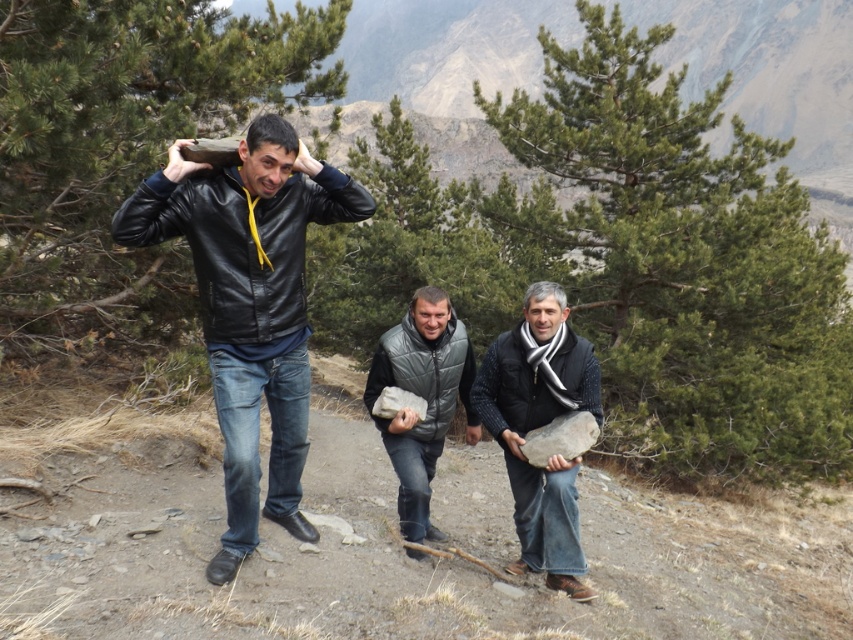
Question: Which object appears farthest from the camera in this image?

Choices:
 (A) gray matte vest at center
 (B) black leather jacket at center

Answer: (A)

Question: Does black leather jacket at center have a smaller size compared to dark gray wool sweater at center?

Choices:
 (A) no
 (B) yes

Answer: (A)

Question: Which object is closer to the camera taking this photo?

Choices:
 (A) dark gray wool sweater at center
 (B) black leather jacket at center
 (C) gray matte vest at center

Answer: (B)

Question: Is black leather jacket at center to the right of gray matte vest at center from the viewer's perspective?

Choices:
 (A) no
 (B) yes

Answer: (A)

Question: Can you confirm if black leather jacket at center is wider than dark gray wool sweater at center?

Choices:
 (A) no
 (B) yes

Answer: (B)

Question: Which of the following is the farthest from the observer?

Choices:
 (A) dark gray wool sweater at center
 (B) gray matte vest at center

Answer: (B)